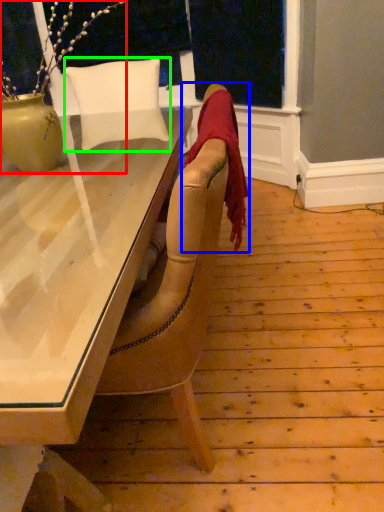
Question: Estimate the real-world distances between objects in this image. Which object is closer to houseplant (highlighted by a red box), blanket (highlighted by a blue box) or pillow (highlighted by a green box)?

Choices:
 (A) blanket
 (B) pillow

Answer: (B)